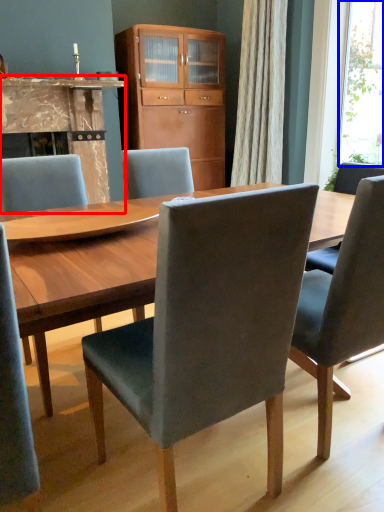
Question: Which object is closer to the camera taking this photo, fireplace (highlighted by a red box) or window screen (highlighted by a blue box)?

Choices:
 (A) fireplace
 (B) window screen

Answer: (A)